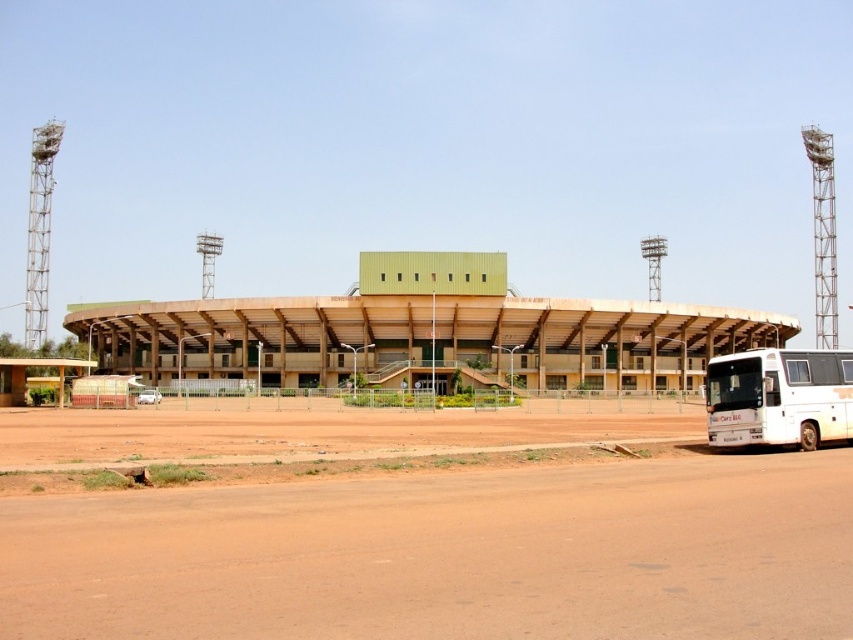
This screenshot has height=640, width=853. I want to click on green matte stadium at center, so click(424, 333).

Is brown dirt track at lower center above white matte bus at lower right?

Correct, brown dirt track at lower center is located above white matte bus at lower right.

Does brown dirt track at lower center have a larger size compared to white matte bus at lower right?

Yes, brown dirt track at lower center is bigger than white matte bus at lower right.

Identify the location of brown dirt track at lower center. (447, 556).

Which is in front, point (659, 564) or point (461, 312)?

Positioned in front is point (659, 564).

Which is in front, point (752, 499) or point (160, 336)?

Point (752, 499)

Locate an element on the screen. brown dirt track at lower center is located at coordinates (447, 556).